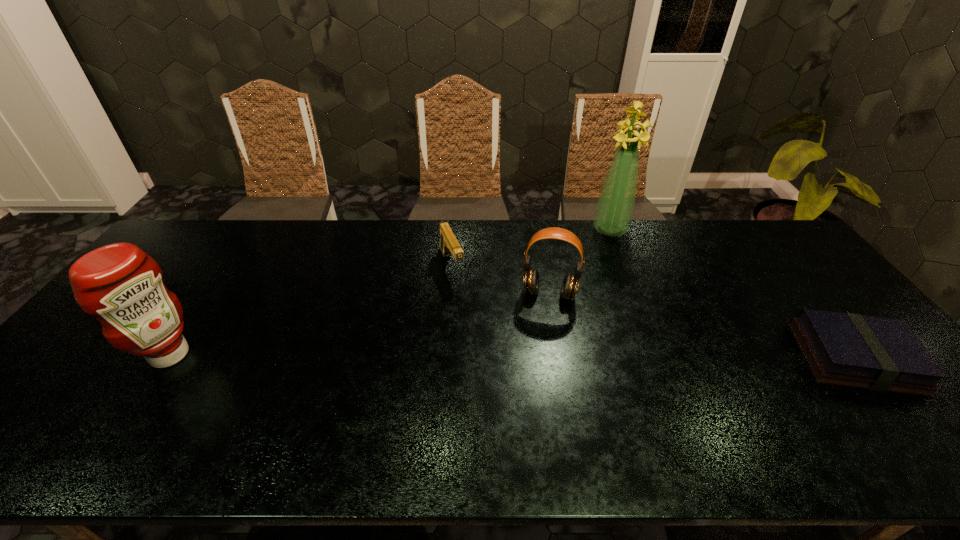
Where is `free space between the headset and the fourth tallest object`? This screenshot has width=960, height=540. free space between the headset and the fourth tallest object is located at coordinates (500, 279).

I want to click on blank region between the book and the condiment, so click(513, 356).

I want to click on object that stands as the second closest to the fourth shortest object, so (x=570, y=284).

This screenshot has height=540, width=960. In order to click on object that is the closest to the rightmost object in this screenshot , I will do `click(615, 207)`.

Identify the location of free space that satisfies the following two spatial constraints: 1. on the front side of the book; 2. on the right side of the tallest object. (659, 357).

What are the coordinates of `vacant region that satisfies the following two spatial constraints: 1. on the back side of the farthest object; 2. on the right side of the condiment` in the screenshot? It's located at (253, 230).

Locate an element on the screen. free point that satisfies the following two spatial constraints: 1. on the front side of the rightmost object; 2. on the right side of the pistol is located at coordinates (444, 357).

This screenshot has height=540, width=960. In order to click on vacant space that satisfies the following two spatial constraints: 1. on the back side of the second tallest object; 2. on the right side of the third tallest object in this screenshot , I will do `click(210, 294)`.